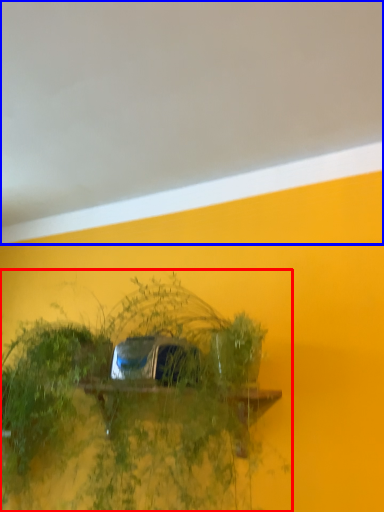
Question: Which object appears closest to the camera in this image, houseplant (highlighted by a red box) or backdrop (highlighted by a blue box)?

Choices:
 (A) houseplant
 (B) backdrop

Answer: (B)